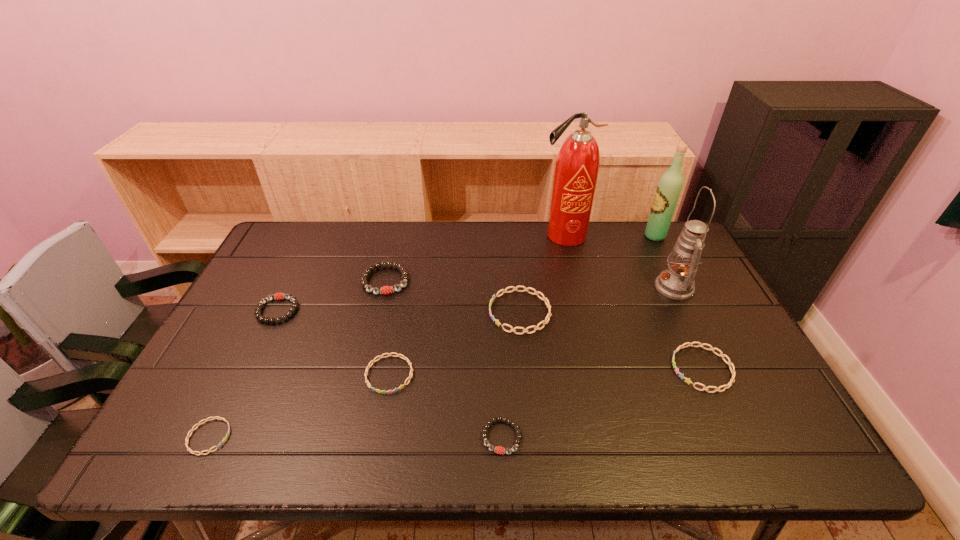
Where is `free region located on the surface of the biggest blue bracelet showing star-shaped elements`? free region located on the surface of the biggest blue bracelet showing star-shaped elements is located at coordinates (385, 312).

Where is `vacant region located 0.220m on the surface of the biggest blue bracelet showing star-shaped elements`? The height and width of the screenshot is (540, 960). vacant region located 0.220m on the surface of the biggest blue bracelet showing star-shaped elements is located at coordinates (413, 312).

Find the location of `free space located on the surface of the biggest blue bracelet showing star-shaped elements`. free space located on the surface of the biggest blue bracelet showing star-shaped elements is located at coordinates (349, 312).

Find the location of a particular element. This screenshot has height=540, width=960. vacant space positioned on the left of the second black bracelet from right to left is located at coordinates (259, 280).

This screenshot has width=960, height=540. In order to click on free space located on the surface of the third smallest blue bracelet showing star-shaped elements in this screenshot , I will do `click(645, 369)`.

Locate an element on the screen. The width and height of the screenshot is (960, 540). free space located 0.210m on the surface of the third smallest blue bracelet showing star-shaped elements is located at coordinates (589, 369).

In order to click on free space located on the surface of the third smallest blue bracelet showing star-shaped elements in this screenshot , I will do `click(645, 369)`.

You are a GUI agent. You are given a task and a screenshot of the screen. Output one action in this format:
    pyautogui.click(x=<x>, y=<y>)
    Task: Click on the vacant space located on the back of the leftmost black bracelet
    The width and height of the screenshot is (960, 540).
    Given the screenshot: What is the action you would take?
    pyautogui.click(x=294, y=276)

This screenshot has height=540, width=960. I want to click on vacant area situated 0.140m on the surface of the second blue bracelet from left to right showing star-shaped elements, so click(x=375, y=450).

Where is `vacant space located on the back of the nearest black bracelet`? The height and width of the screenshot is (540, 960). vacant space located on the back of the nearest black bracelet is located at coordinates (497, 336).